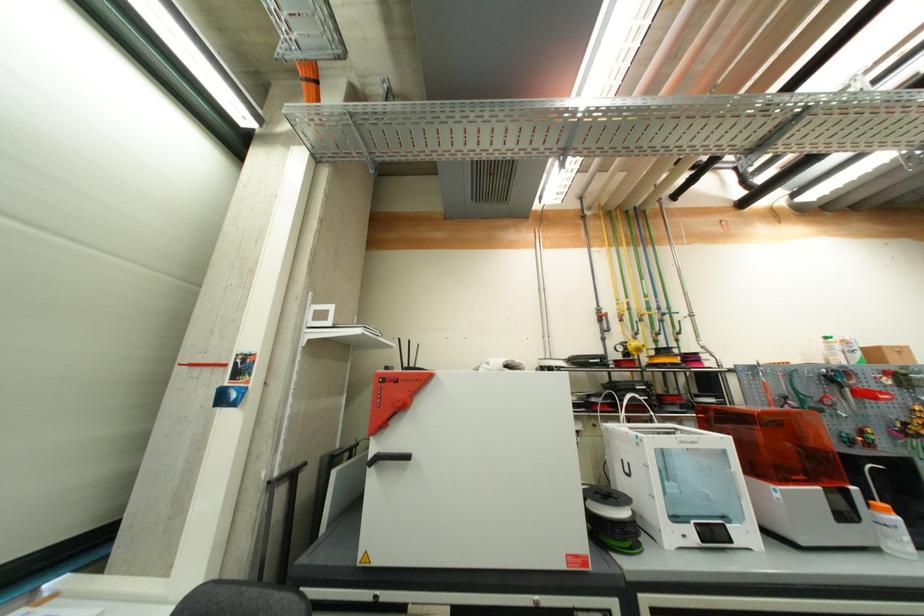
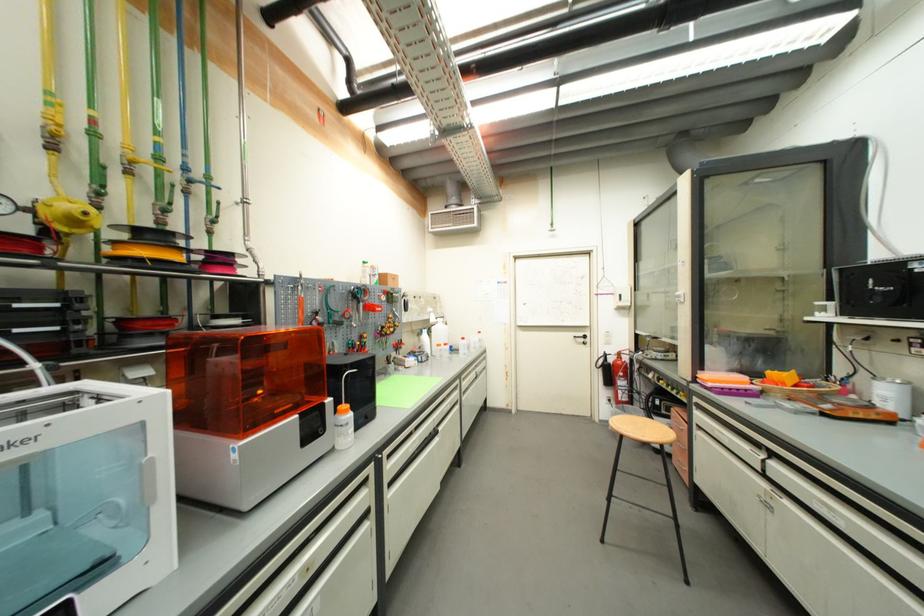
The point at (740, 432) is marked in the first image. Where is the corresponding point in the second image?

(237, 363)